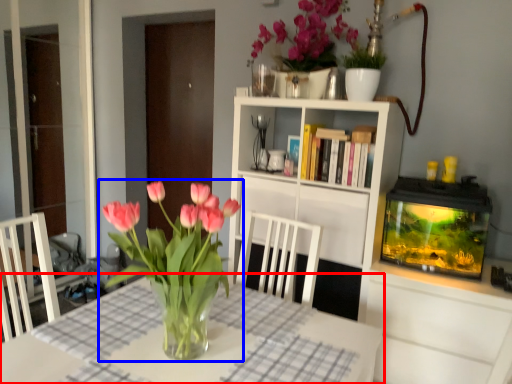
Question: Which point is further to the camera, table (highlighted by a red box) or houseplant (highlighted by a blue box)?

Choices:
 (A) table
 (B) houseplant

Answer: (B)